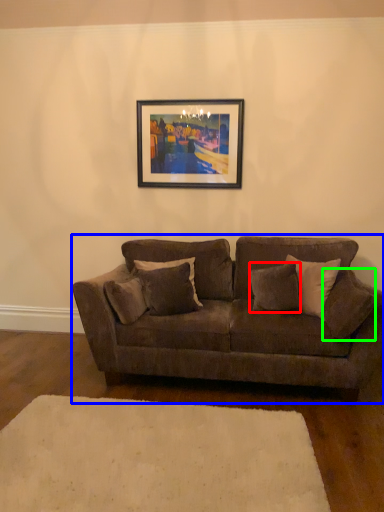
Question: Estimate the real-world distances between objects in this image. Which object is closer to pillow (highlighted by a red box), studio couch (highlighted by a blue box) or pillow (highlighted by a green box)?

Choices:
 (A) studio couch
 (B) pillow

Answer: (B)